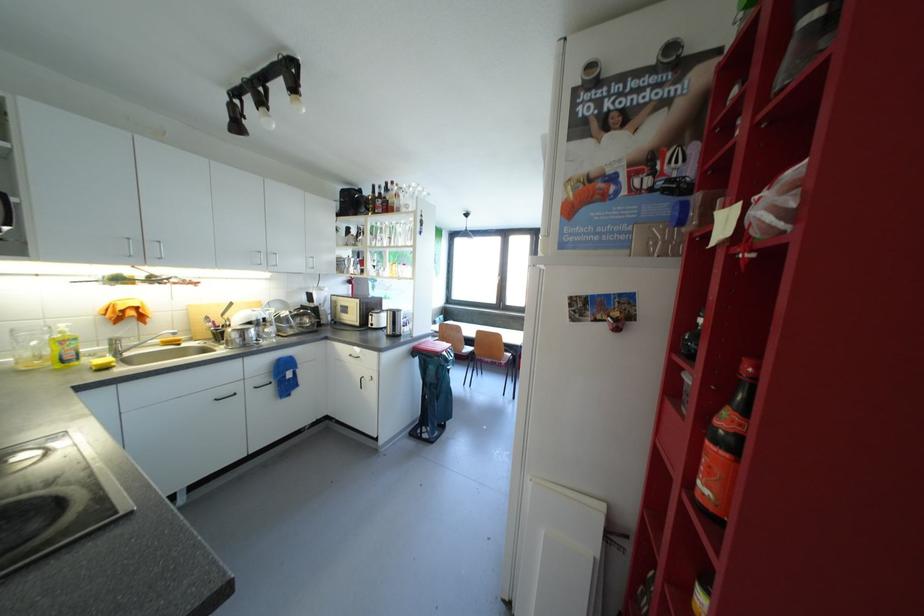
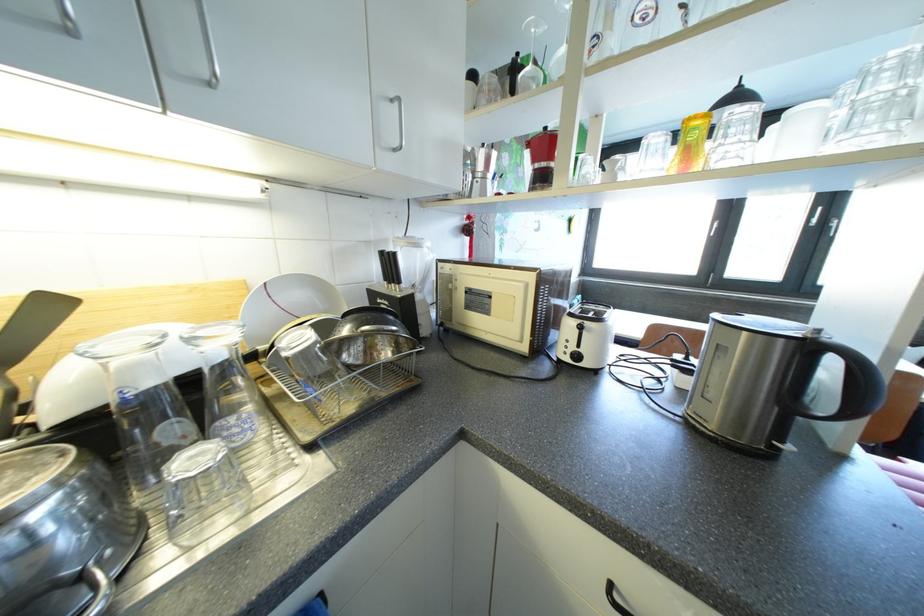
The images are taken continuously from a first-person perspective. In which direction are you moving?

The movement direction of the cameraman is left, forward.